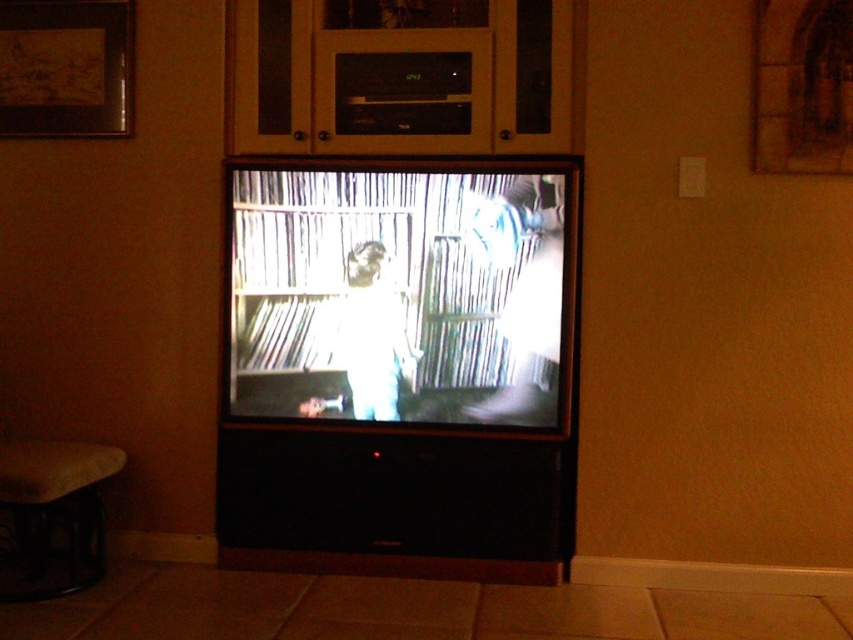
Question: Is matte black flat screen tv at center below smooth brown stool at lower left?

Choices:
 (A) no
 (B) yes

Answer: (A)

Question: Does wooden framed artwork at upper left come behind smooth brown stool at lower left?

Choices:
 (A) yes
 (B) no

Answer: (A)

Question: Which of these objects is positioned closest to the smooth brown stool at lower left?

Choices:
 (A) matte black flat screen tv at center
 (B) black matte television at center

Answer: (B)

Question: Which of the following is the closest to the observer?

Choices:
 (A) smooth brown stool at lower left
 (B) black matte television at center

Answer: (A)

Question: Which is farther from the wooden framed artwork at upper left?

Choices:
 (A) matte black flat screen tv at center
 (B) black matte television at center
 (C) smooth brown stool at lower left

Answer: (C)

Question: Does matte black flat screen tv at center have a lesser width compared to wooden framed artwork at upper left?

Choices:
 (A) yes
 (B) no

Answer: (B)